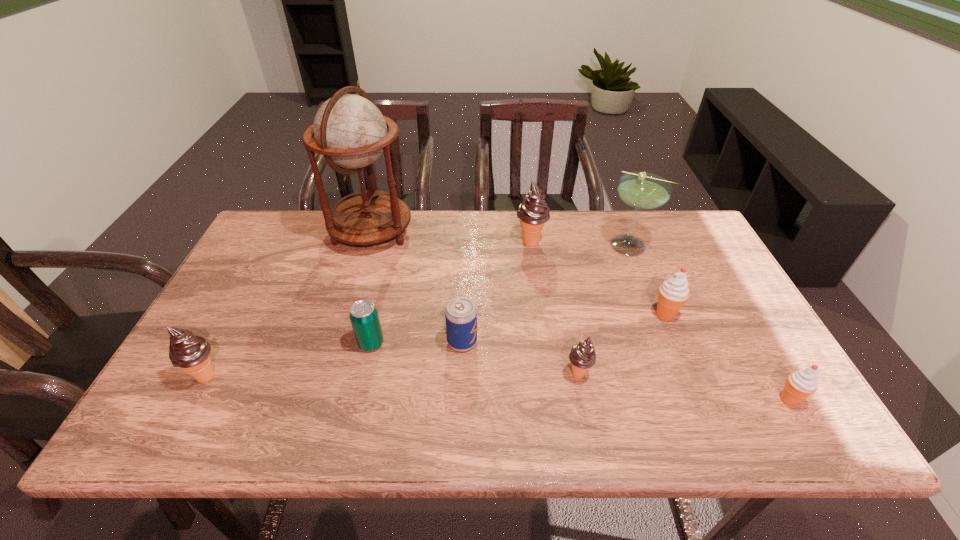
I want to click on vacant region between the farthest icecream and the smallest chocolate icecream, so click(x=555, y=308).

The image size is (960, 540). I want to click on free spot between the green martini and the teal beer can, so click(501, 294).

You are a GUI agent. You are given a task and a screenshot of the screen. Output one action in this format:
    pyautogui.click(x=<x>, y=<y>)
    Task: Click on the vacant space that's between the smallest chocolate icecream and the leftmost chocolate icecream
    The height and width of the screenshot is (540, 960).
    Given the screenshot: What is the action you would take?
    pyautogui.click(x=392, y=375)

Image resolution: width=960 pixels, height=540 pixels. I want to click on free point between the rightmost icecream and the smallest chocolate icecream, so click(684, 387).

Locate an element on the screen. The height and width of the screenshot is (540, 960). unoccupied area between the smallest chocolate icecream and the fourth object from left to right is located at coordinates [520, 358].

At what (x,y) coordinates should I click in order to perform the action: click on vacant region between the globe and the teal beer can. Please return your answer as a coordinate pair (x, y). The image size is (960, 540). Looking at the image, I should click on (372, 288).

Choose which object is the sixth nearest neighbor to the right red icecream. Please provide its 2D coordinates. Your answer should be formatted as a tuple, i.e. [(x, y)], where the tuple contains the x and y coordinates of a point satisfying the conditions above.

[(363, 315)]

You are a GUI agent. You are given a task and a screenshot of the screen. Output one action in this format:
    pyautogui.click(x=<x>, y=<y>)
    Task: Click on the object that is the fifth nearest to the rightmost object
    This screenshot has width=960, height=540.
    Given the screenshot: What is the action you would take?
    coord(460,313)

Locate which icecream ranks fifth in proximity to the teal beer can. Please provide its 2D coordinates. Your answer should be formatted as a tuple, i.e. [(x, y)], where the tuple contains the x and y coordinates of a point satisfying the conditions above.

[(801, 384)]

Where is `the third closest icecream to the tallest object`? Image resolution: width=960 pixels, height=540 pixels. the third closest icecream to the tallest object is located at coordinates (582, 356).